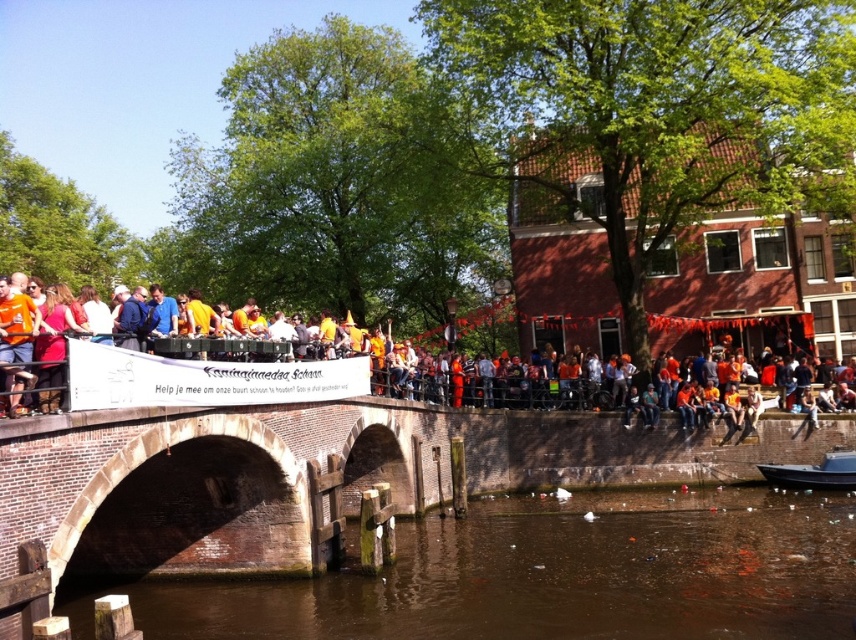
Between brown murky water at lower center and black glossy boat at lower right, which one appears on the left side from the viewer's perspective?

From the viewer's perspective, brown murky water at lower center appears more on the left side.

Is brown murky water at lower center positioned at the back of black glossy boat at lower right?

No.

Is point (539, 618) in front of point (833, 474)?

Yes.

Identify the location of brown murky water at lower center. (550, 576).

Does brown murky water at lower center lie behind orange fabric banner at center?

Yes, it is behind orange fabric banner at center.

Looking at this image, can you confirm if brown murky water at lower center is thinner than orange fabric banner at center?

Yes, brown murky water at lower center is thinner than orange fabric banner at center.

At what (x,y) coordinates should I click in order to perform the action: click on brown murky water at lower center. Please return your answer as a coordinate pair (x, y). Looking at the image, I should click on (550, 576).

Does orange fabric banner at center have a larger size compared to black glossy boat at lower right?

Correct, orange fabric banner at center is larger in size than black glossy boat at lower right.

Can you confirm if orange fabric banner at center is smaller than black glossy boat at lower right?

No, orange fabric banner at center is not smaller than black glossy boat at lower right.

Does point (54, 364) come behind point (825, 456)?

No, (54, 364) is in front of (825, 456).

What are the coordinates of `orange fabric banner at center` in the screenshot? It's located at (197, 372).